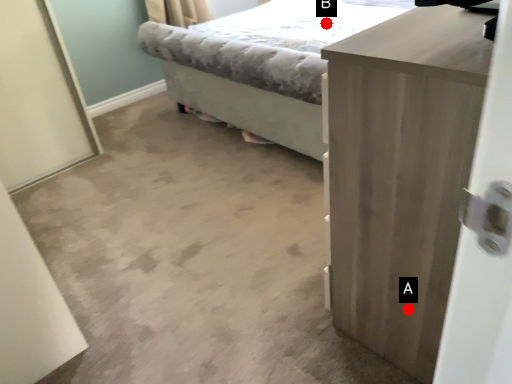
Question: Two points are circled on the image, labeled by A and B beside each circle. Which of the following is the closest to the observer?

Choices:
 (A) A is closer
 (B) B is closer

Answer: (A)